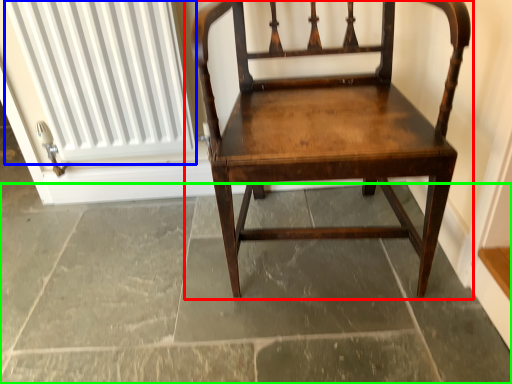
Question: Which is nearer to the chair (highlighted by a red box)? radiator (highlighted by a blue box) or concrete (highlighted by a green box).

Choices:
 (A) radiator
 (B) concrete

Answer: (B)